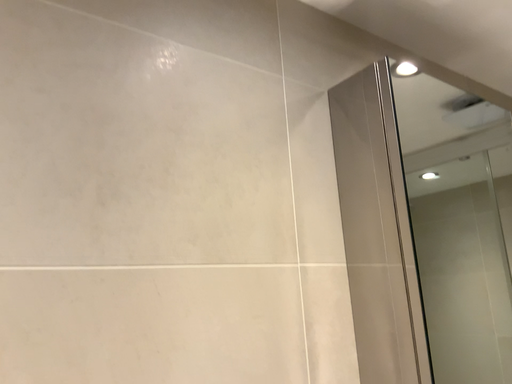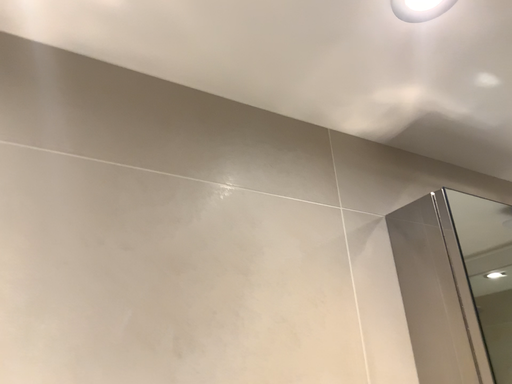
Question: Which way did the camera rotate in the video?

Choices:
 (A) rotated left
 (B) rotated right

Answer: (A)